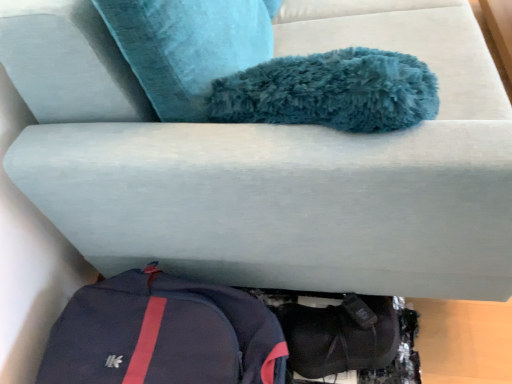
Image resolution: width=512 pixels, height=384 pixels. I want to click on black fabric shoe at lower center, so click(x=340, y=335).

The image size is (512, 384). What do you see at coordinates (340, 335) in the screenshot? I see `black fabric shoe at lower center` at bounding box center [340, 335].

What do you see at coordinates (163, 334) in the screenshot?
I see `navy blue fabric backpack at lower left` at bounding box center [163, 334].

You are a GUI agent. You are given a task and a screenshot of the screen. Output one action in this format:
    pyautogui.click(x=<x>, y=<y>)
    Task: Click on the navy blue fabric backpack at lower left
    The width and height of the screenshot is (512, 384).
    Given the screenshot: What is the action you would take?
    pyautogui.click(x=163, y=334)

Identify the location of black fabric shoe at lower center. This screenshot has width=512, height=384. (340, 335).

Which object is positioned more to the right, black fabric shoe at lower center or navy blue fabric backpack at lower left?

From the viewer's perspective, black fabric shoe at lower center appears more on the right side.

From the picture: Considering the positions of objects black fabric shoe at lower center and navy blue fabric backpack at lower left in the image provided, who is in front, black fabric shoe at lower center or navy blue fabric backpack at lower left?

navy blue fabric backpack at lower left is more forward.

Is point (328, 316) positioned after point (122, 276)?

Yes, it is.

From the image's perspective, relative to navy blue fabric backpack at lower left, is black fabric shoe at lower center above or below?

From the image's perspective, black fabric shoe at lower center appears below navy blue fabric backpack at lower left.

From a real-world perspective, is black fabric shoe at lower center below navy blue fabric backpack at lower left?

Yes, from a real-world perspective, black fabric shoe at lower center is beneath navy blue fabric backpack at lower left.

Can you confirm if black fabric shoe at lower center is wider than navy blue fabric backpack at lower left?

No, black fabric shoe at lower center is not wider than navy blue fabric backpack at lower left.

Considering the sizes of objects black fabric shoe at lower center and navy blue fabric backpack at lower left in the image provided, who is shorter, black fabric shoe at lower center or navy blue fabric backpack at lower left?

Standing shorter between the two is black fabric shoe at lower center.

In terms of size, does black fabric shoe at lower center appear bigger or smaller than navy blue fabric backpack at lower left?

In the image, black fabric shoe at lower center appears to be smaller than navy blue fabric backpack at lower left.

Consider the image. Could navy blue fabric backpack at lower left be considered to be inside black fabric shoe at lower center?

No, navy blue fabric backpack at lower left is not surrounded by black fabric shoe at lower center.

From the picture: Is black fabric shoe at lower center not close to navy blue fabric backpack at lower left?

black fabric shoe at lower center is near navy blue fabric backpack at lower left, not far away.

Is navy blue fabric backpack at lower left at the back of black fabric shoe at lower center?

black fabric shoe at lower center does not have its back to navy blue fabric backpack at lower left.

Find the location of a particular element. This screenshot has height=384, width=512. shoe lying on the right of navy blue fabric backpack at lower left is located at coordinates (340, 335).

Which object is positioned more to the right, navy blue fabric backpack at lower left or black fabric shoe at lower center?

black fabric shoe at lower center is more to the right.

Relative to black fabric shoe at lower center, is navy blue fabric backpack at lower left in front or behind?

Visually, navy blue fabric backpack at lower left is located in front of black fabric shoe at lower center.

Does point (145, 273) appear closer or farther from the camera than point (319, 352)?

Clearly, point (145, 273) is closer to the camera than point (319, 352).

From the image's perspective, which object appears higher, navy blue fabric backpack at lower left or black fabric shoe at lower center?

navy blue fabric backpack at lower left is shown above in the image.

From a real-world perspective, between navy blue fabric backpack at lower left and black fabric shoe at lower center, who is vertically lower?

black fabric shoe at lower center is physically lower.

Is navy blue fabric backpack at lower left thinner than black fabric shoe at lower center?

In fact, navy blue fabric backpack at lower left might be wider than black fabric shoe at lower center.

From their relative heights in the image, would you say navy blue fabric backpack at lower left is taller or shorter than black fabric shoe at lower center?

Clearly, navy blue fabric backpack at lower left is taller compared to black fabric shoe at lower center.

Looking at this image, considering the sizes of navy blue fabric backpack at lower left and black fabric shoe at lower center in the image, is navy blue fabric backpack at lower left bigger or smaller than black fabric shoe at lower center?

Clearly, navy blue fabric backpack at lower left is larger in size than black fabric shoe at lower center.

Is black fabric shoe at lower center located within navy blue fabric backpack at lower left?

That's incorrect, black fabric shoe at lower center is not inside navy blue fabric backpack at lower left.

Is navy blue fabric backpack at lower left not near black fabric shoe at lower center?

navy blue fabric backpack at lower left is near black fabric shoe at lower center, not far away.

Could you tell me if navy blue fabric backpack at lower left is facing black fabric shoe at lower center?

No, navy blue fabric backpack at lower left is not facing towards black fabric shoe at lower center.

The image size is (512, 384). Find the location of `shoe below the navy blue fabric backpack at lower left (from the image's perspective)`. shoe below the navy blue fabric backpack at lower left (from the image's perspective) is located at coordinates (340, 335).

Identify the location of shoe to the right of navy blue fabric backpack at lower left. (340, 335).

This screenshot has width=512, height=384. I want to click on backpack above the black fabric shoe at lower center (from the image's perspective), so click(163, 334).